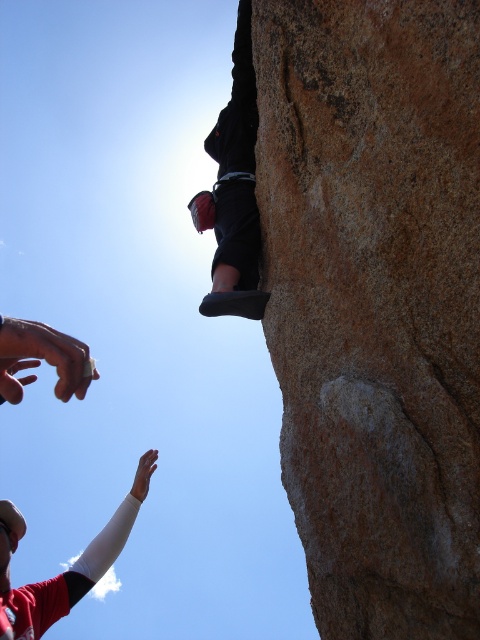
Which of these two, brown rough rock at upper right or black fabric climbing harness at upper center, stands shorter?

black fabric climbing harness at upper center

Between brown rough rock at upper right and black fabric climbing harness at upper center, which one is positioned higher?

black fabric climbing harness at upper center

The image size is (480, 640). Find the location of `brown rough rock at upper right`. brown rough rock at upper right is located at coordinates (374, 301).